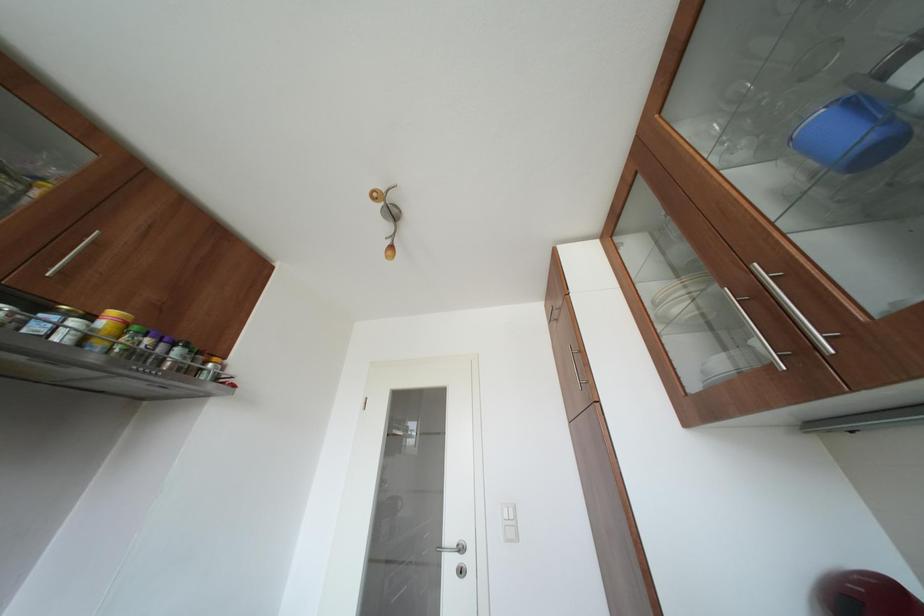
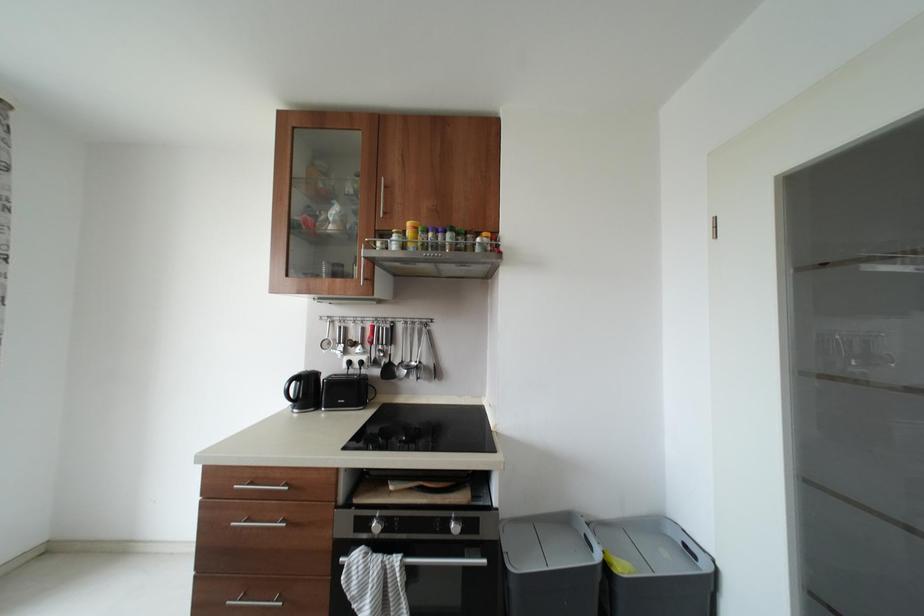
Question: How did the camera likely rotate?

Choices:
 (A) Left
 (B) Right
 (C) Up
 (D) Down

Answer: (A)